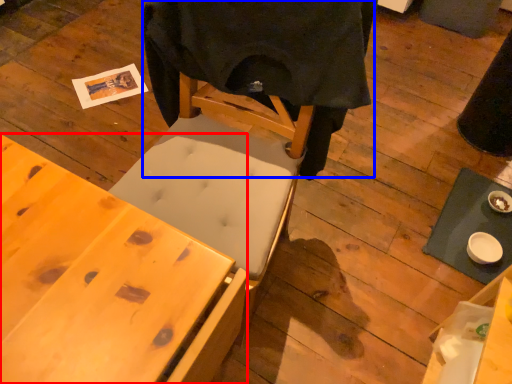
Question: Which of the following is the closest to the observer, desk (highlighted by a red box) or cloth (highlighted by a blue box)?

Choices:
 (A) desk
 (B) cloth

Answer: (A)